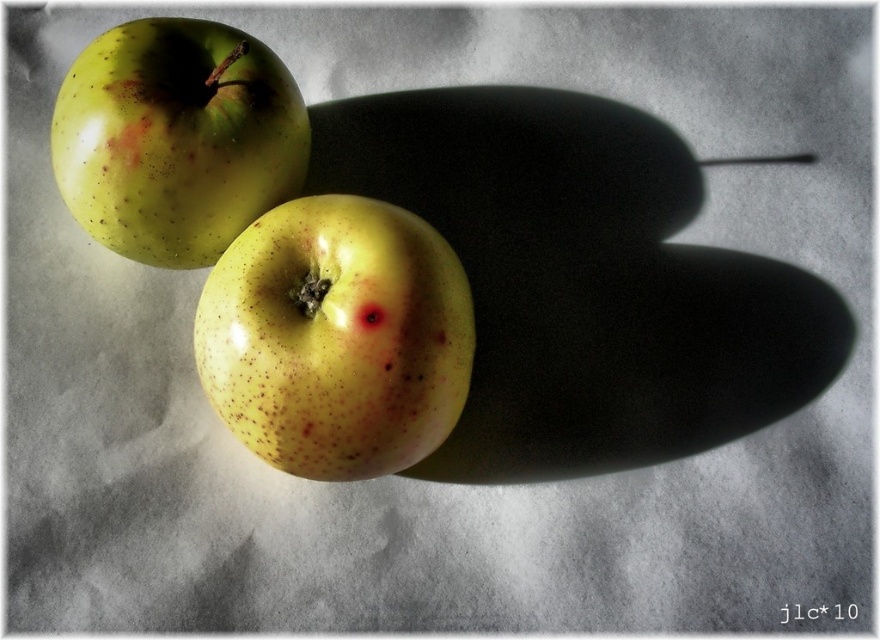
Who is more distant from viewer, (424, 324) or (163, 56)?

Positioned behind is point (163, 56).

Does yellow speckled apple at center have a smaller size compared to green speckled apple at upper left?

Indeed, yellow speckled apple at center has a smaller size compared to green speckled apple at upper left.

Is point (231, 349) in front of point (259, 67)?

That is True.

You are a GUI agent. You are given a task and a screenshot of the screen. Output one action in this format:
    pyautogui.click(x=<x>, y=<y>)
    Task: Click on the yellow speckled apple at center
    This screenshot has width=880, height=640.
    Given the screenshot: What is the action you would take?
    pyautogui.click(x=336, y=337)